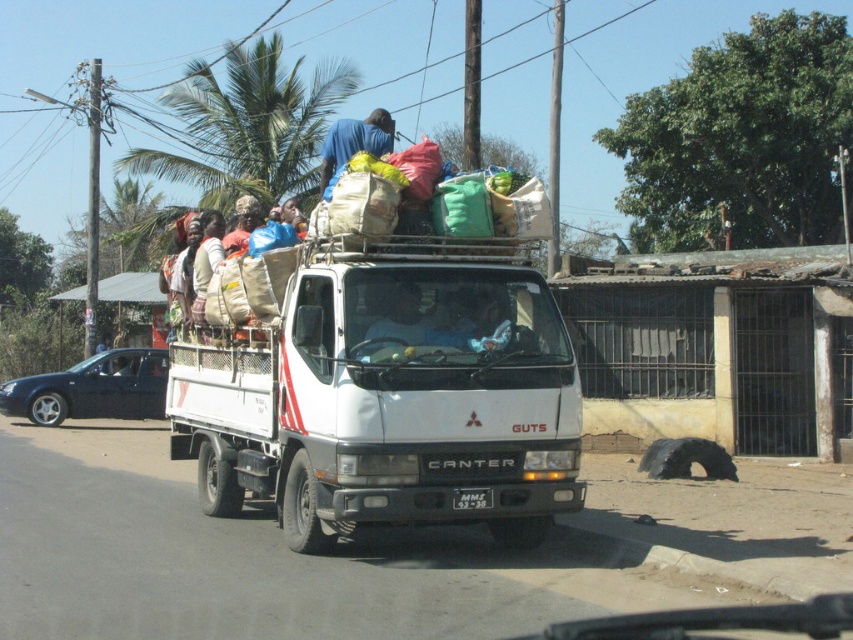
Between green leafy palm tree at upper center and blue fabric bag at upper center, which one is positioned higher?

green leafy palm tree at upper center

The height and width of the screenshot is (640, 853). Describe the element at coordinates (248, 125) in the screenshot. I see `green leafy palm tree at upper center` at that location.

Locate an element on the screen. Image resolution: width=853 pixels, height=640 pixels. green leafy palm tree at upper center is located at coordinates (248, 125).

Measure the distance from green leafy palm tree at upper center to blue fabric shirt at center.

green leafy palm tree at upper center is 21.95 meters away from blue fabric shirt at center.

Based on the photo, is green leafy palm tree at upper center behind blue fabric shirt at center?

Yes, it is behind blue fabric shirt at center.

You are a GUI agent. You are given a task and a screenshot of the screen. Output one action in this format:
    pyautogui.click(x=<x>, y=<y>)
    Task: Click on the green leafy palm tree at upper center
    
    Given the screenshot: What is the action you would take?
    (248, 125)

Who is higher up, green leafy palm tree at upper center or brown woven basket at upper center?

green leafy palm tree at upper center

Does green leafy palm tree at upper center appear on the left side of brown woven basket at upper center?

Yes, green leafy palm tree at upper center is to the left of brown woven basket at upper center.

Which is in front, point (228, 122) or point (252, 218)?

Point (252, 218) is in front.

Image resolution: width=853 pixels, height=640 pixels. I want to click on green leafy palm tree at upper center, so click(248, 125).